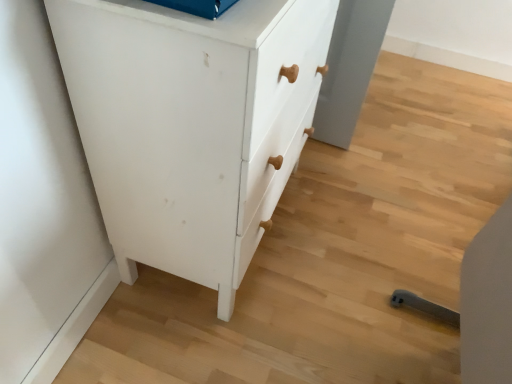
Where is `white matte cabinet at center`? The height and width of the screenshot is (384, 512). white matte cabinet at center is located at coordinates (191, 124).

Describe the element at coordinates (191, 124) in the screenshot. The image size is (512, 384). I see `white matte cabinet at center` at that location.

Identify the location of white matte cabinet at center. Image resolution: width=512 pixels, height=384 pixels. (191, 124).